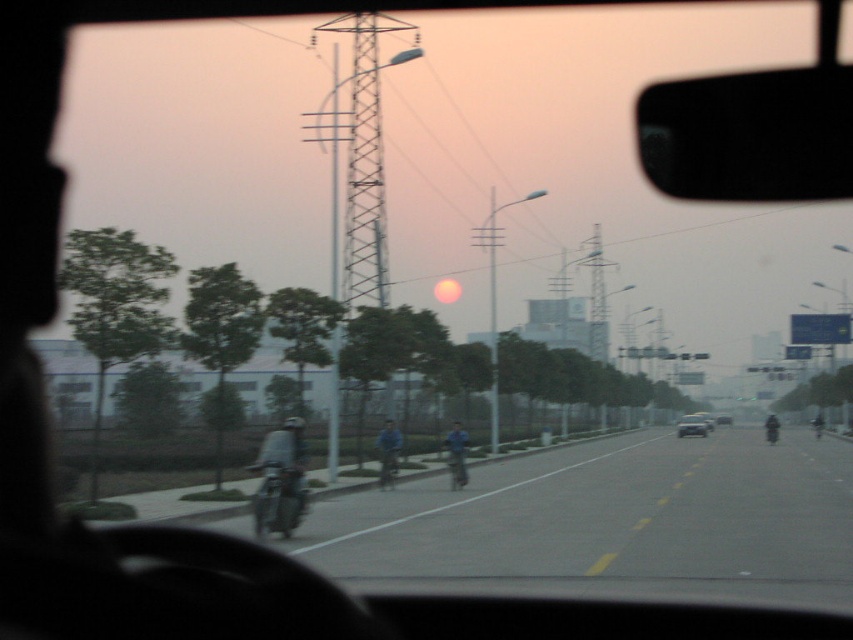
Between point (708, 161) and point (393, 452), which one is positioned in front?

Positioned in front is point (708, 161).

Which is behind, point (821, 116) or point (392, 428)?

The point (392, 428) is more distant.

Where is `black glossy view mirror at upper right`? The width and height of the screenshot is (853, 640). black glossy view mirror at upper right is located at coordinates (749, 134).

Is metallic silver bicycle at center positioned behind dark blue helmet at center?

That is False.

Does metallic silver bicycle at center have a greater height compared to dark blue helmet at center?

No, metallic silver bicycle at center is not taller than dark blue helmet at center.

Is point (386, 458) behind point (822, 419)?

No, (386, 458) is in front of (822, 419).

Find the location of `metallic silver bicycle at center`. metallic silver bicycle at center is located at coordinates (387, 467).

Can you confirm if metallic silver bicycle at center is positioned to the left of metallic silver car at center?

Correct, you'll find metallic silver bicycle at center to the left of metallic silver car at center.

Is point (392, 449) less distant than point (718, 417)?

That is True.

Is point (392, 464) farther from viewer compared to point (727, 417)?

No.

Identify the location of metallic silver bicycle at center. (387, 467).